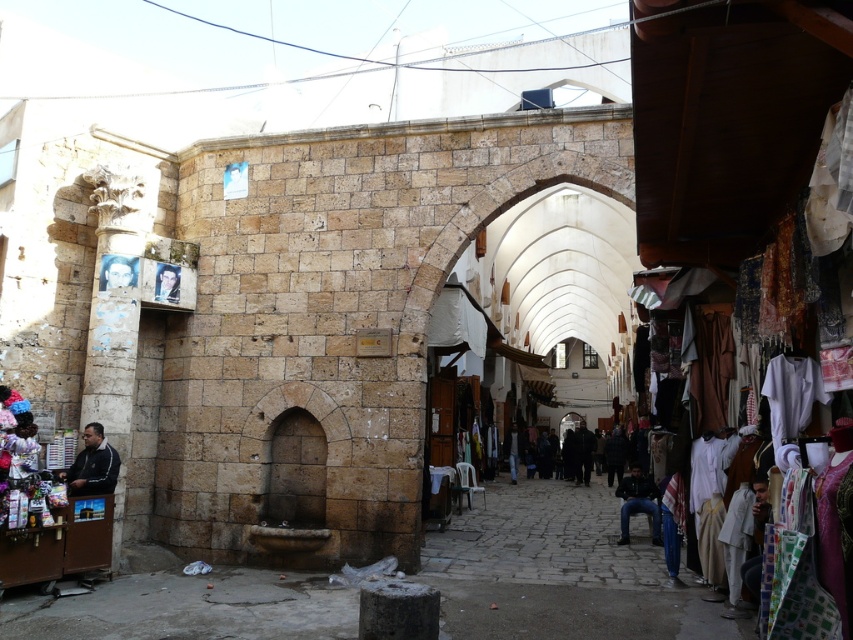
You are a traveler standing in the market and want to buy a jacket and jeans. You notice the dark gray fabric jacket at lower left and dark blue jeans at lower right. Which item is shorter in height?

The dark gray fabric jacket at lower left is not as tall as the dark blue jeans at lower right, so the jacket is shorter in height.

You are a traveler standing at the market entrance. You see a dark gray fabric jacket at lower left and a dark blue jeans at lower right. Can you walk directly between them without any obstacles?

The distance between the dark gray fabric jacket at lower left and the dark blue jeans at lower right is 118.83 feet, so yes, you can walk directly between them without any obstacles since the distance is sufficient.

You are standing at the center of the market and see two points marked in the scene. Which point is closer to you, point [74,486] or point [648,476]?

Point [74,486] is in front of point [648,476], so it is closer to you.